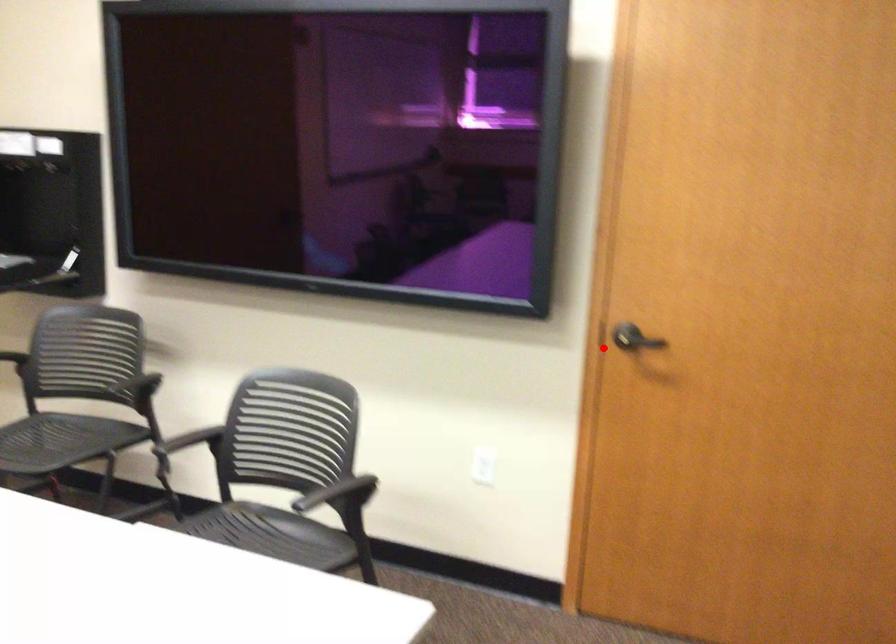
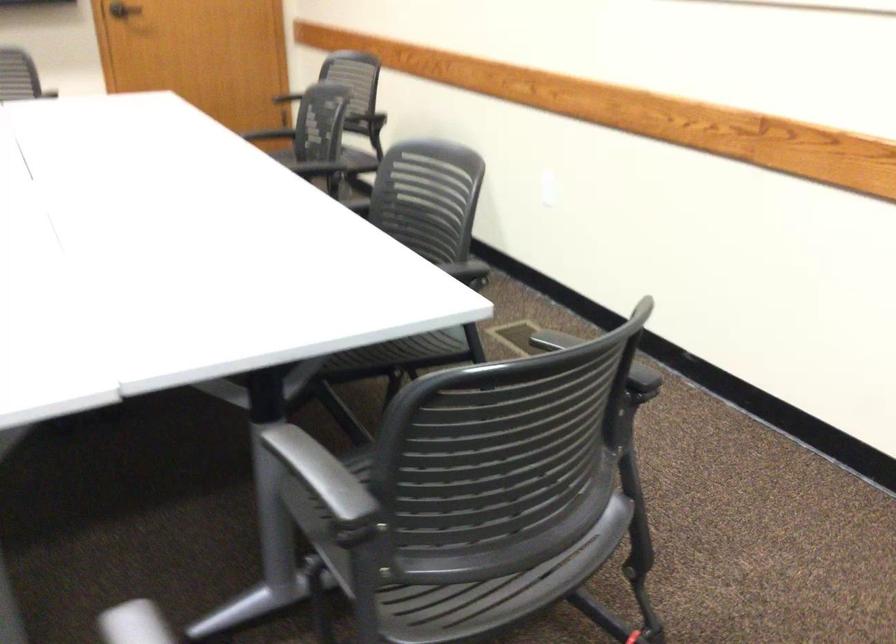
Locate, in the second image, the point that corresponds to the highlighted location in the first image.

(123, 10)